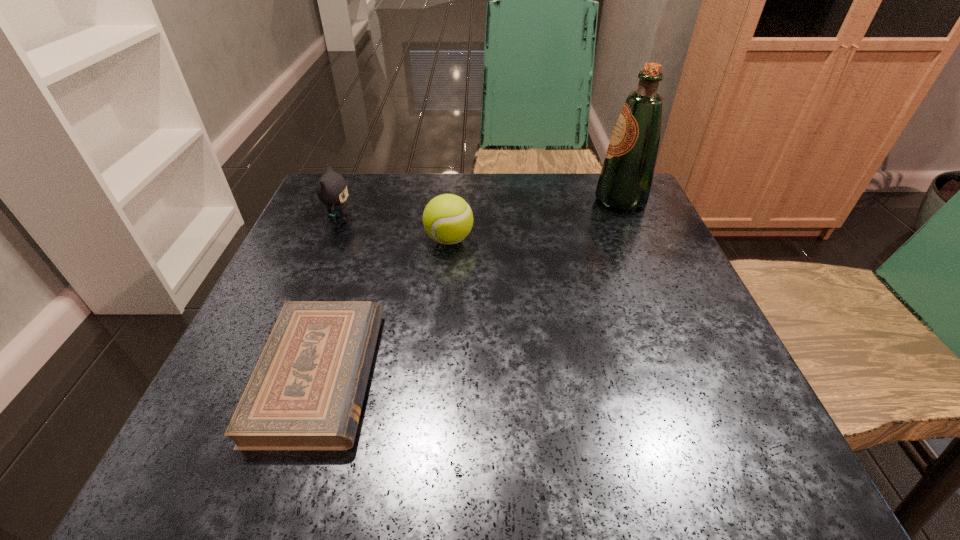
Locate an element on the screen. The height and width of the screenshot is (540, 960). free point located on the left of the tennis ball is located at coordinates (323, 240).

You are a GUI agent. You are given a task and a screenshot of the screen. Output one action in this format:
    pyautogui.click(x=<x>, y=<y>)
    Task: Click on the free space located 0.130m on the spine side of the shortest object
    This screenshot has height=540, width=960.
    Given the screenshot: What is the action you would take?
    pyautogui.click(x=459, y=375)

What are the coordinates of `olive oil that is at the far edge` in the screenshot? It's located at (626, 177).

Identify the location of kitten located at the far edge. The height and width of the screenshot is (540, 960). (332, 190).

Where is `tennis ball located in the far edge section of the desktop`? tennis ball located in the far edge section of the desktop is located at coordinates (447, 219).

Identify the location of object at the near edge. The width and height of the screenshot is (960, 540). (306, 392).

I want to click on kitten that is positioned at the left edge, so click(332, 190).

Identify the location of Bible that is at the left edge. (306, 392).

Identify the location of object that is at the right edge. This screenshot has width=960, height=540. (626, 177).

Locate an element on the screen. This screenshot has width=960, height=540. object situated at the far left corner is located at coordinates (332, 190).